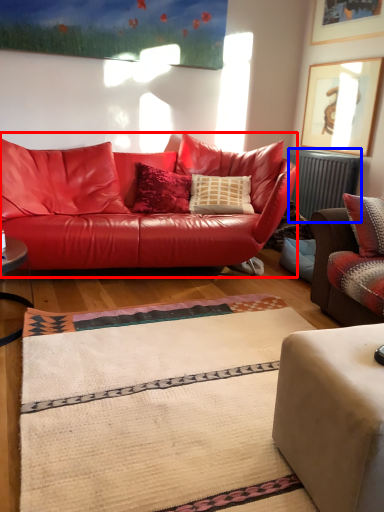
Question: Which object appears closest to the camera in this image, studio couch (highlighted by a red box) or radiator (highlighted by a blue box)?

Choices:
 (A) studio couch
 (B) radiator

Answer: (A)